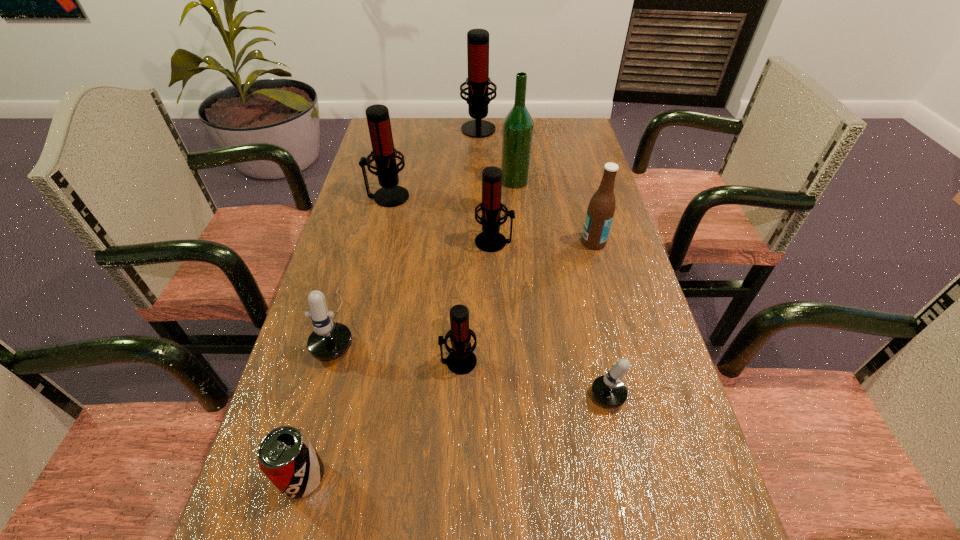
Where is `the nearest red microphone`? This screenshot has height=540, width=960. the nearest red microphone is located at coordinates (461, 360).

At what (x,y) coordinates should I click in order to perform the action: click on the smaller white microphone. Please return your answer as a coordinate pair (x, y). Image resolution: width=960 pixels, height=540 pixels. Looking at the image, I should click on (x=608, y=390).

Find the location of a particular element. the rightmost microphone is located at coordinates tap(608, 390).

You are a GUI agent. You are given a task and a screenshot of the screen. Output one action in this format:
    pyautogui.click(x=<x>, y=<y>)
    Task: Click on the soda can
    This screenshot has width=960, height=540.
    Given the screenshot: What is the action you would take?
    pyautogui.click(x=286, y=456)

At what (x,y) coordinates should I click in order to perform the action: click on vacant space positioned 0.280m on the right of the farthest microphone. Please return your answer as a coordinate pair (x, y). The width and height of the screenshot is (960, 540). Looking at the image, I should click on (573, 127).

Find the location of a particular element. The image size is (960, 540). blank space located 0.220m on the right of the alcohol is located at coordinates (601, 181).

Locate an element on the screen. The height and width of the screenshot is (540, 960). vacant point located 0.100m on the front of the third smallest red microphone is located at coordinates (379, 230).

Where is `vacant region located on the left of the beer bottle`? vacant region located on the left of the beer bottle is located at coordinates (513, 242).

You are a GUI agent. You are given a task and a screenshot of the screen. Output one action in this format:
    pyautogui.click(x=<x>, y=<y>)
    Task: Click on the vacant space positioned on the right of the third farthest microphone
    This screenshot has height=540, width=960.
    Given the screenshot: What is the action you would take?
    pyautogui.click(x=582, y=242)

This screenshot has height=540, width=960. I want to click on vacant space located on the back of the farther white microphone, so click(x=361, y=248).